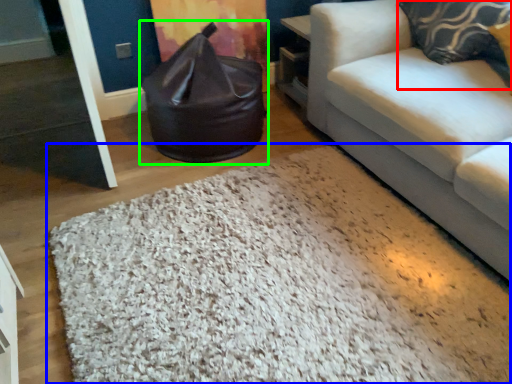
Question: Based on their relative distances, which object is farther from pillow (highlighted by a red box)? Choose from mat (highlighted by a blue box) and bean bag chair (highlighted by a green box).

Choices:
 (A) mat
 (B) bean bag chair

Answer: (A)